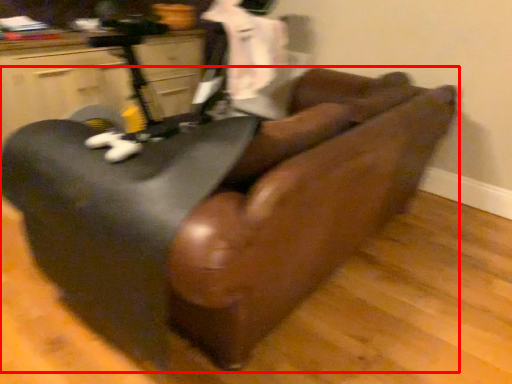
Question: From the image's perspective, where is furniture (annotated by the red box) located in relation to furniture in the image?

Choices:
 (A) below
 (B) above

Answer: (A)